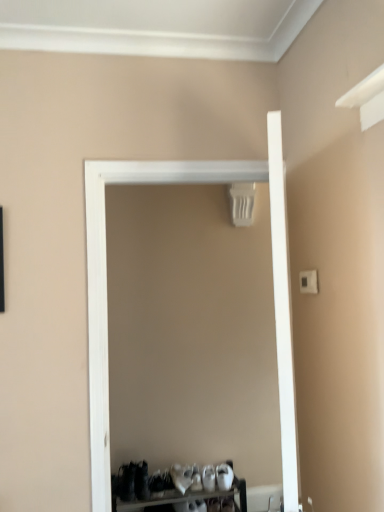
The width and height of the screenshot is (384, 512). What do you see at coordinates (107, 301) in the screenshot?
I see `white matte door at center` at bounding box center [107, 301].

Locate an element on the screen. white matte door at center is located at coordinates (107, 301).

What is the approximate width of white plastic shoe rack at lower center?

white plastic shoe rack at lower center is 13.16 inches in width.

This screenshot has height=512, width=384. Describe the element at coordinates (177, 489) in the screenshot. I see `white plastic shoe rack at lower center` at that location.

The height and width of the screenshot is (512, 384). What are the coordinates of `white plastic shoe rack at lower center` in the screenshot? It's located at (177, 489).

What are the coordinates of `white matte door at center` in the screenshot? It's located at (107, 301).

Considering the relative positions of white plastic shoe rack at lower center and white matte door at center in the image provided, is white plastic shoe rack at lower center to the left of white matte door at center from the viewer's perspective?

Correct, you'll find white plastic shoe rack at lower center to the left of white matte door at center.

Is white plastic shoe rack at lower center positioned before white matte door at center?

That is False.

Is point (177, 499) closer to viewer compared to point (202, 182)?

Yes, point (177, 499) is in front of point (202, 182).

From the image's perspective, is white plastic shoe rack at lower center above or below white matte door at center?

Clearly, from the image's perspective, white plastic shoe rack at lower center is below white matte door at center.

From a real-world perspective, is white plastic shoe rack at lower center positioned above or below white matte door at center?

Clearly, from a real-world perspective, white plastic shoe rack at lower center is below white matte door at center.

Does white plastic shoe rack at lower center have a greater width compared to white matte door at center?

Indeed, white plastic shoe rack at lower center has a greater width compared to white matte door at center.

Based on the photo, considering the relative sizes of white plastic shoe rack at lower center and white matte door at center in the image provided, is white plastic shoe rack at lower center shorter than white matte door at center?

Yes, white plastic shoe rack at lower center is shorter than white matte door at center.

Who is bigger, white plastic shoe rack at lower center or white matte door at center?

With larger size is white matte door at center.

Does white plastic shoe rack at lower center contain white matte door at center?

No, white matte door at center is not a part of white plastic shoe rack at lower center.

Are white plastic shoe rack at lower center and white matte door at center far apart?

white plastic shoe rack at lower center is positioned a significant distance from white matte door at center.

Is white plastic shoe rack at lower center facing away from white matte door at center?

white plastic shoe rack at lower center is not turned away from white matte door at center.

How much distance is there between white plastic shoe rack at lower center and white matte door at center?

A distance of 1.13 meters exists between white plastic shoe rack at lower center and white matte door at center.

Identify the location of furniture to the left of white matte door at center. (177, 489).

Can you confirm if white matte door at center is positioned to the left of white plastic shoe rack at lower center?

No, white matte door at center is not to the left of white plastic shoe rack at lower center.

Considering the positions of objects white matte door at center and white plastic shoe rack at lower center in the image provided, who is in front, white matte door at center or white plastic shoe rack at lower center?

white matte door at center is in front.

Which is in front, point (122, 176) or point (134, 482)?

Positioned in front is point (122, 176).

From the image's perspective, which one is positioned lower, white matte door at center or white plastic shoe rack at lower center?

white plastic shoe rack at lower center, from the image's perspective.

From a real-world perspective, between white matte door at center and white plastic shoe rack at lower center, who is vertically lower?

white plastic shoe rack at lower center is physically lower.

Between white matte door at center and white plastic shoe rack at lower center, which one has smaller width?

white matte door at center is thinner.

Which of these two, white matte door at center or white plastic shoe rack at lower center, stands shorter?

white plastic shoe rack at lower center.

Looking at the image, does white matte door at center seem bigger or smaller compared to white plastic shoe rack at lower center?

white matte door at center is bigger than white plastic shoe rack at lower center.

Which is correct: white matte door at center is inside white plastic shoe rack at lower center, or outside of it?

white matte door at center lies outside white plastic shoe rack at lower center.

Is white matte door at center with white plastic shoe rack at lower center?

white matte door at center and white plastic shoe rack at lower center are clearly separated.

Does white matte door at center turn towards white plastic shoe rack at lower center?

No, white matte door at center is not aimed at white plastic shoe rack at lower center.

You are a GUI agent. You are given a task and a screenshot of the screen. Output one action in this format:
    pyautogui.click(x=<x>, y=<y>)
    Task: Click on the furniture below the white matte door at center (from the image's perspective)
    The width and height of the screenshot is (384, 512).
    Given the screenshot: What is the action you would take?
    pyautogui.click(x=177, y=489)

Where is `furniture behind the white matte door at center`? The width and height of the screenshot is (384, 512). furniture behind the white matte door at center is located at coordinates coord(177,489).

Image resolution: width=384 pixels, height=512 pixels. I want to click on door positioned vertically above the white plastic shoe rack at lower center (from a real-world perspective), so click(x=107, y=301).